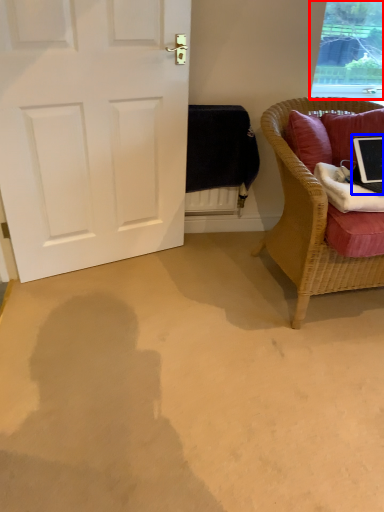
Question: Which object is further to the camera taking this photo, window (highlighted by a red box) or laptop (highlighted by a blue box)?

Choices:
 (A) window
 (B) laptop

Answer: (A)